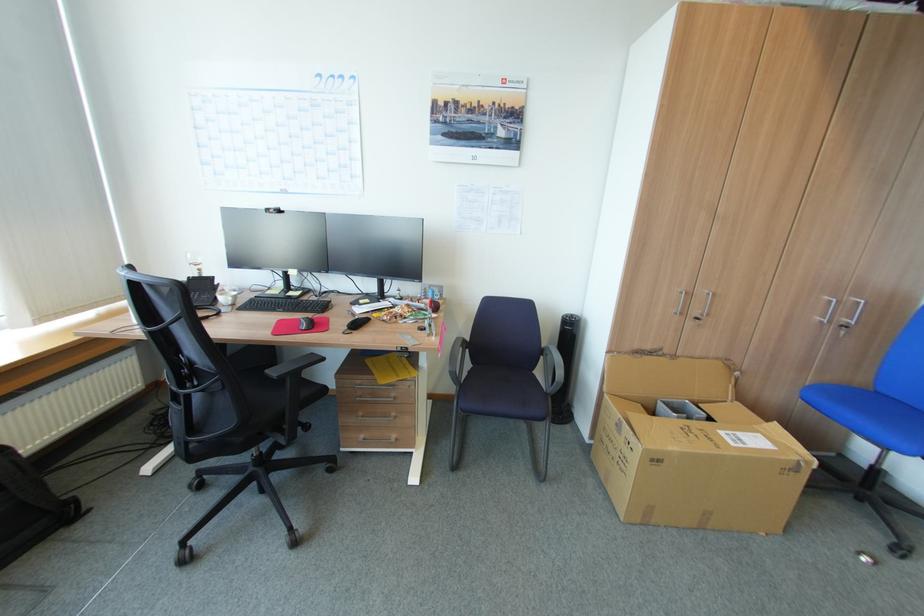
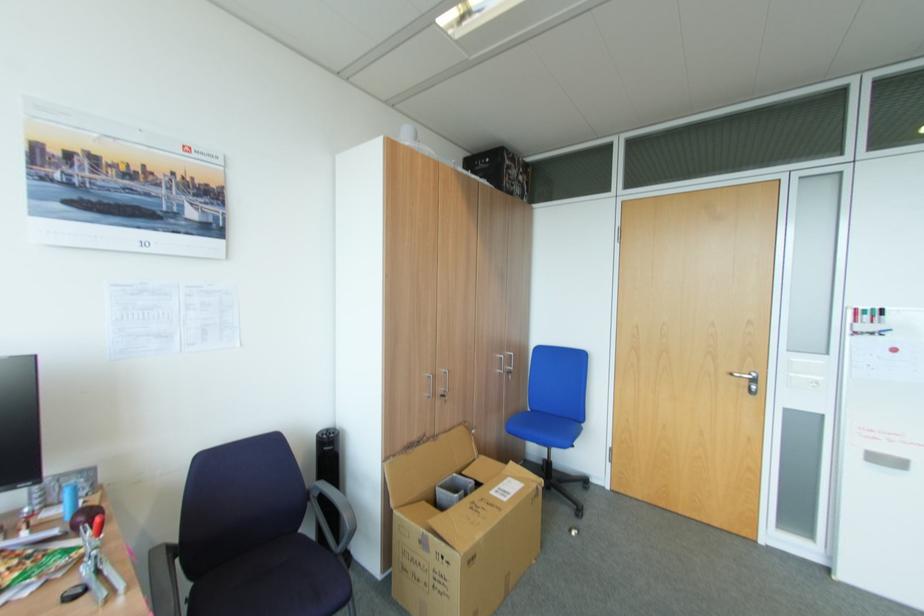
Find the pixel in the second image that matches the point at 477,368 in the first image.

(198, 588)